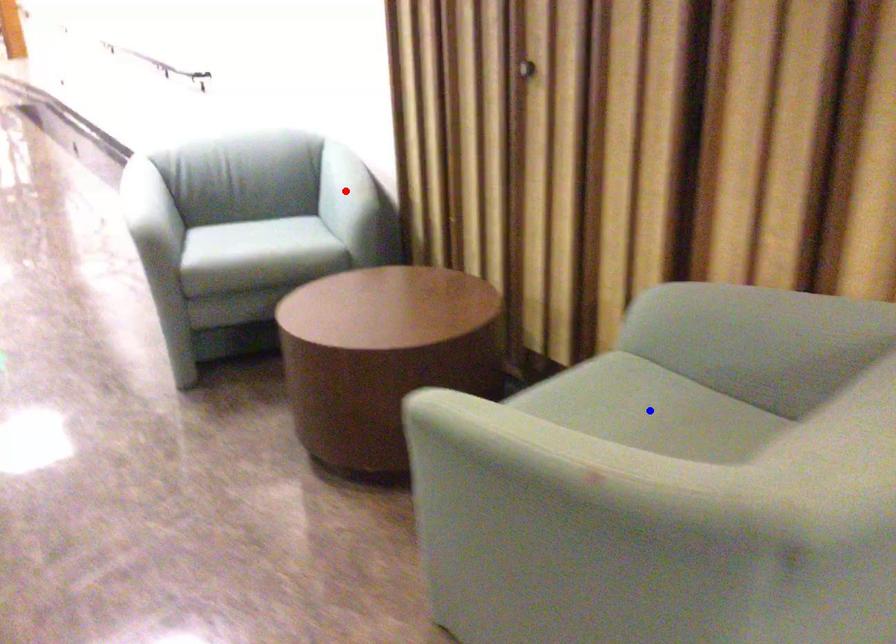
Question: Two points are marked on the image. Which point is closer to the camera?

Choices:
 (A) Blue point is closer.
 (B) Red point is closer.

Answer: (A)